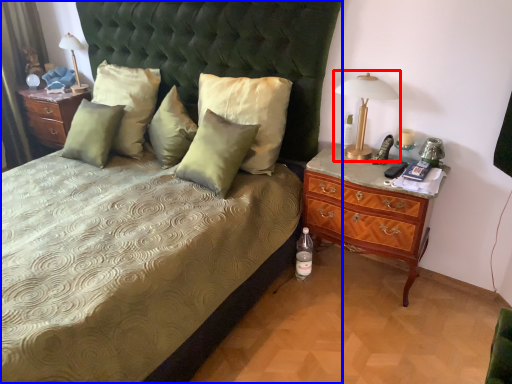
Question: Which object appears closest to the camera in this image, bedside lamp (highlighted by a red box) or bed (highlighted by a blue box)?

Choices:
 (A) bedside lamp
 (B) bed

Answer: (B)